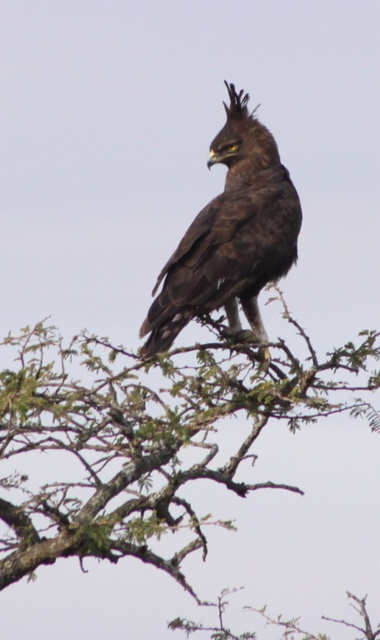
Does point (221, 326) come in front of point (172, 320)?

No, it is not.

Where is `green leafy branch at upper center`? This screenshot has height=640, width=380. green leafy branch at upper center is located at coordinates (148, 436).